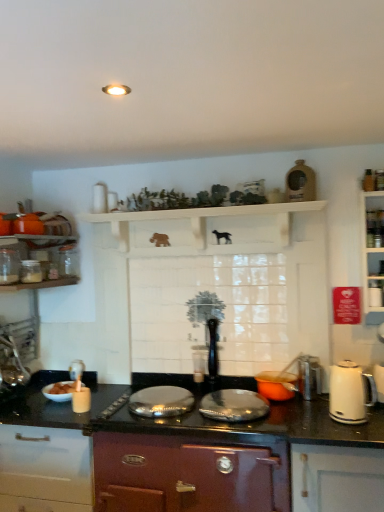
Question: From the image's perspective, would you say clear glass jar at left, positioned as the fourth kitchen appliance in right-to-left order, is positioned over white glossy bowl at lower left?

Choices:
 (A) no
 (B) yes

Answer: (B)

Question: Can you confirm if clear glass jar at left, which is the 1th kitchen appliance in left-to-right order, is positioned to the left of white glossy bowl at lower left?

Choices:
 (A) no
 (B) yes

Answer: (B)

Question: Is clear glass jar at left, which is the 1th kitchen appliance in left-to-right order, beside white glossy bowl at lower left?

Choices:
 (A) yes
 (B) no

Answer: (B)

Question: Does clear glass jar at left, which is the 1th kitchen appliance in left-to-right order, have a larger size compared to white glossy bowl at lower left?

Choices:
 (A) no
 (B) yes

Answer: (A)

Question: From the image's perspective, would you say clear glass jar at left, positioned as the fourth kitchen appliance in right-to-left order, is shown under white glossy bowl at lower left?

Choices:
 (A) no
 (B) yes

Answer: (A)

Question: Can you confirm if clear glass jar at left, which is the 1th kitchen appliance in left-to-right order, is smaller than white glossy bowl at lower left?

Choices:
 (A) yes
 (B) no

Answer: (A)

Question: Is clear glass jar at left, which is the second kitchen appliance in top-to-bottom order, at the left side of white glossy bowl at lower left?

Choices:
 (A) yes
 (B) no

Answer: (A)

Question: Does clear glass jar at left, the 2th kitchen appliance positioned from the left, lie in front of white glossy bowl at lower left?

Choices:
 (A) yes
 (B) no

Answer: (A)

Question: Is the surface of clear glass jar at left, which is the third kitchen appliance in right-to-left order, in direct contact with white glossy bowl at lower left?

Choices:
 (A) yes
 (B) no

Answer: (B)

Question: Does clear glass jar at left, the 2th kitchen appliance positioned from the left, lie behind white glossy bowl at lower left?

Choices:
 (A) yes
 (B) no

Answer: (B)

Question: Does clear glass jar at left, which is the third kitchen appliance in right-to-left order, have a greater height compared to white glossy bowl at lower left?

Choices:
 (A) yes
 (B) no

Answer: (A)

Question: Is clear glass jar at left, which is the third kitchen appliance in right-to-left order, positioned beyond the bounds of white glossy bowl at lower left?

Choices:
 (A) no
 (B) yes

Answer: (B)

Question: From a real-world perspective, is white glossy bowl at lower left located higher than orange matte pot at center, positioned as the fourth kitchen appliance in top-to-bottom order?

Choices:
 (A) no
 (B) yes

Answer: (A)